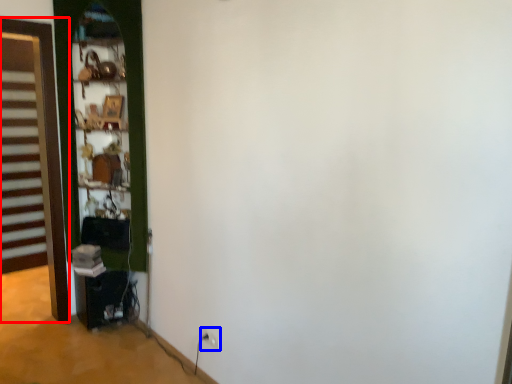
Question: Which object is closer to the camera taking this photo, door (highlighted by a red box) or electric outlet (highlighted by a blue box)?

Choices:
 (A) door
 (B) electric outlet

Answer: (B)